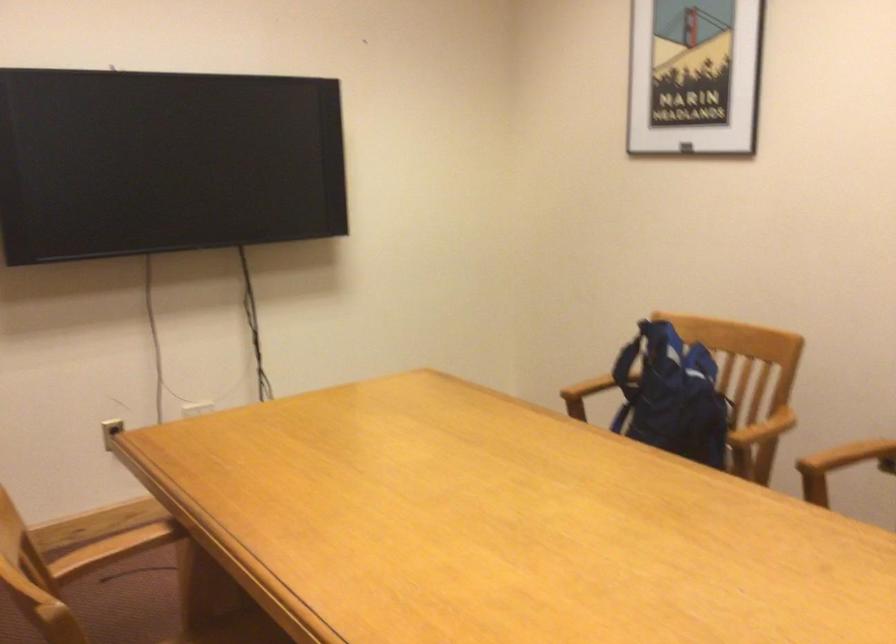
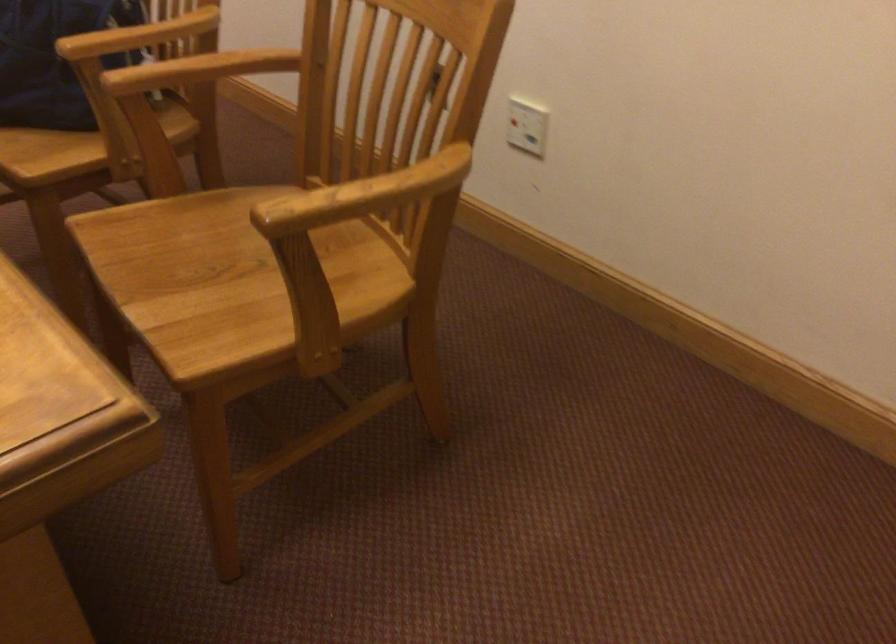
In a continuous first-person perspective shot, in which direction is the camera moving?

The cameraman moved toward right, forward.